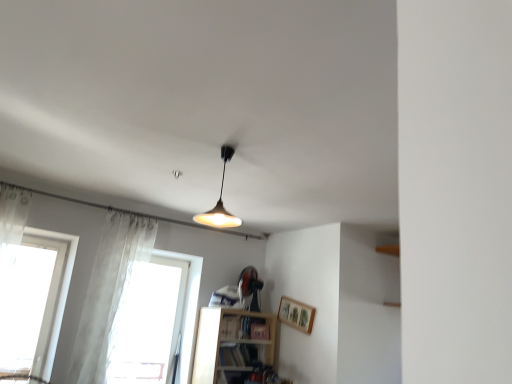
The width and height of the screenshot is (512, 384). What do you see at coordinates (220, 201) in the screenshot? I see `matte gold pendant light at center` at bounding box center [220, 201].

This screenshot has height=384, width=512. Describe the element at coordinates (233, 346) in the screenshot. I see `wooden at lower center` at that location.

In order to face wooden at lower center, should I rotate leftwards or rightwards?

It's best to rotate left around 2.698 degrees.

What is the approximate width of white glass window at left, which ranks as the 1th window in left-to-right order?

12.14 inches.

At what (x,y) coordinates should I click in order to perform the action: click on wooden framed picture at upper right. Please return your answer as a coordinate pair (x, y). This screenshot has width=512, height=384. Looking at the image, I should click on (296, 314).

Could you tell me if translucent fabric curtain at left is facing metallic silver fan at center?

No.

The width and height of the screenshot is (512, 384). I want to click on curtain located underneath the metallic silver fan at center (from a real-world perspective), so click(x=109, y=293).

Considering the relative sizes of translucent fabric curtain at left and metallic silver fan at center in the image provided, is translucent fabric curtain at left thinner than metallic silver fan at center?

Correct, the width of translucent fabric curtain at left is less than that of metallic silver fan at center.

Is translucent fabric curtain at left with metallic silver fan at center?

translucent fabric curtain at left is not next to metallic silver fan at center, and they're not touching.

Can you tell me how much transparent fabric at lower left, which ranks as the second window in left-to-right order, and metallic silver fan at center differ in facing direction?

0.345 degrees.

Measure the distance from transparent fabric at lower left, which ranks as the second window in left-to-right order, to metallic silver fan at center.

A distance of 36.48 inches exists between transparent fabric at lower left, which ranks as the second window in left-to-right order, and metallic silver fan at center.

Is transparent fabric at lower left, which ranks as the second window in left-to-right order, completely or partially outside of metallic silver fan at center?

That's correct, transparent fabric at lower left, which ranks as the second window in left-to-right order, is outside of metallic silver fan at center.

Is transparent fabric at lower left, which appears as the 1th window when viewed from the right, touching metallic silver fan at center?

There is a gap between transparent fabric at lower left, which appears as the 1th window when viewed from the right, and metallic silver fan at center.

Find the location of `fan behind the hardcover book at lower center, which is the 1th book in bottom-to-top order`. fan behind the hardcover book at lower center, which is the 1th book in bottom-to-top order is located at coordinates (249, 288).

Between point (231, 348) and point (239, 285), which one is positioned in front?

Positioned in front is point (231, 348).

Is hardcover book at lower center, which is the 1th book in bottom-to-top order, at the right side of metallic silver fan at center?

In fact, hardcover book at lower center, which is the 1th book in bottom-to-top order, is to the left of metallic silver fan at center.

Between point (46, 374) and point (238, 360), which one is positioned behind?

Point (238, 360)

Is white glass window at left, the 2th window positioned from the right, behind hardcover book at lower center, the second book positioned from the top?

No, white glass window at left, the 2th window positioned from the right, is in front of hardcover book at lower center, the second book positioned from the top.

Which object is positioned more to the left, white glass window at left, the 2th window positioned from the right, or hardcover book at lower center, which is the 1th book in bottom-to-top order?

white glass window at left, the 2th window positioned from the right.

Considering the positions of point (268, 324) and point (249, 351), is point (268, 324) closer or farther from the camera than point (249, 351)?

Clearly, point (268, 324) is more distant from the camera than point (249, 351).

Which object is thinner, matte black bookshelf at lower center, which is counted as the 2th book, starting from the bottom, or hardcover book at lower center, which is the 1th book in bottom-to-top order?

Thinner between the two is matte black bookshelf at lower center, which is counted as the 2th book, starting from the bottom.

Between matte black bookshelf at lower center, the 1th book in the top-to-bottom sequence, and hardcover book at lower center, the second book positioned from the top, which one is positioned in front?

hardcover book at lower center, the second book positioned from the top, is in front.

Locate an element on the screen. This screenshot has width=512, height=384. book on the left of matte black bookshelf at lower center, the 1th book in the top-to-bottom sequence is located at coordinates (239, 355).

Is metallic silver fan at center looking in the opposite direction of matte gold pendant light at center?

That's not correct — metallic silver fan at center is not looking away from matte gold pendant light at center.

Is metallic silver fan at center to the left or to the right of matte gold pendant light at center in the image?

In the image, metallic silver fan at center appears on the right side of matte gold pendant light at center.

From a real-world perspective, which is physically above, metallic silver fan at center or matte gold pendant light at center?

In real-world perspective, matte gold pendant light at center is above.

Considering the sizes of objects metallic silver fan at center and matte gold pendant light at center in the image provided, who is thinner, metallic silver fan at center or matte gold pendant light at center?

metallic silver fan at center is thinner.

Considering the relative sizes of white glass window at left, the 2th window positioned from the right, and wooden framed picture at upper right in the image provided, is white glass window at left, the 2th window positioned from the right, smaller than wooden framed picture at upper right?

No.

Is there a large distance between white glass window at left, which ranks as the 1th window in left-to-right order, and wooden framed picture at upper right?

white glass window at left, which ranks as the 1th window in left-to-right order, is positioned a significant distance from wooden framed picture at upper right.

Based on the photo, from their relative heights in the image, would you say white glass window at left, the 2th window positioned from the right, is taller or shorter than wooden framed picture at upper right?

In the image, white glass window at left, the 2th window positioned from the right, appears to be taller than wooden framed picture at upper right.

Locate an element on the screen. curtain lying on the left of metallic silver fan at center is located at coordinates (109, 293).

What are the coordinates of `window located below the metallic silver fan at center (from the image's perspective)` in the screenshot? It's located at (151, 324).

From the image, which object appears to be nearer to matte black bookshelf at lower center, the 1th book in the top-to-bottom sequence, wooden at lower center or translucent fabric curtain at left?

wooden at lower center lies closer to matte black bookshelf at lower center, the 1th book in the top-to-bottom sequence, than the other object.

Estimate the real-world distances between objects in this image. Which object is further from white glass window at left, the 2th window positioned from the right, hardcover book at lower center, which is the 1th book in bottom-to-top order, or metallic silver fan at center?

The object further to white glass window at left, the 2th window positioned from the right, is metallic silver fan at center.

Estimate the real-world distances between objects in this image. Which object is further from metallic silver fan at center, white glass window at left, the 2th window positioned from the right, or wooden framed picture at upper right?

Based on the image, white glass window at left, the 2th window positioned from the right, appears to be further to metallic silver fan at center.

Looking at this image, based on their spatial positions, is wooden framed picture at upper right or matte black bookshelf at lower center, which is counted as the 2th book, starting from the bottom, closer to metallic silver fan at center?

matte black bookshelf at lower center, which is counted as the 2th book, starting from the bottom.

When comparing their distances from matte gold pendant light at center, does transparent fabric at lower left, which ranks as the second window in left-to-right order, or wooden framed picture at upper right seem further?

wooden framed picture at upper right is further to matte gold pendant light at center.

From the image, which object appears to be nearer to wooden at lower center, matte gold pendant light at center or translucent fabric curtain at left?

Based on the image, translucent fabric curtain at left appears to be nearer to wooden at lower center.

Looking at the image, which one is located further to matte black bookshelf at lower center, which is counted as the 2th book, starting from the bottom, matte gold pendant light at center or hardcover book at lower center, the second book positioned from the top?

Based on the image, matte gold pendant light at center appears to be further to matte black bookshelf at lower center, which is counted as the 2th book, starting from the bottom.

Which object lies nearer to the anchor point matte black bookshelf at lower center, which is counted as the 2th book, starting from the bottom, transparent fabric at lower left, which ranks as the second window in left-to-right order, or wooden at lower center?

wooden at lower center lies closer to matte black bookshelf at lower center, which is counted as the 2th book, starting from the bottom, than the other object.

You are a GUI agent. You are given a task and a screenshot of the screen. Output one action in this format:
    pyautogui.click(x=<x>, y=<y>)
    Task: Click on the window located between white glass window at left, the 2th window positioned from the right, and matte black bookshelf at lower center, the 1th book in the top-to-bottom sequence, in the left-right direction
    The width and height of the screenshot is (512, 384).
    Given the screenshot: What is the action you would take?
    pyautogui.click(x=151, y=324)

Identify the location of shelf situated between translucent fabric curtain at left and wooden framed picture at upper right from left to right. The height and width of the screenshot is (384, 512). (233, 346).

This screenshot has height=384, width=512. What are the coordinates of `book between wooden at lower center and matte black bookshelf at lower center, which is counted as the 2th book, starting from the bottom, in the front-back direction` in the screenshot? It's located at (239, 355).

Find the location of `curtain situated between white glass window at left, which ranks as the 1th window in left-to-right order, and wooden framed picture at upper right from left to right`. curtain situated between white glass window at left, which ranks as the 1th window in left-to-right order, and wooden framed picture at upper right from left to right is located at coordinates (109, 293).